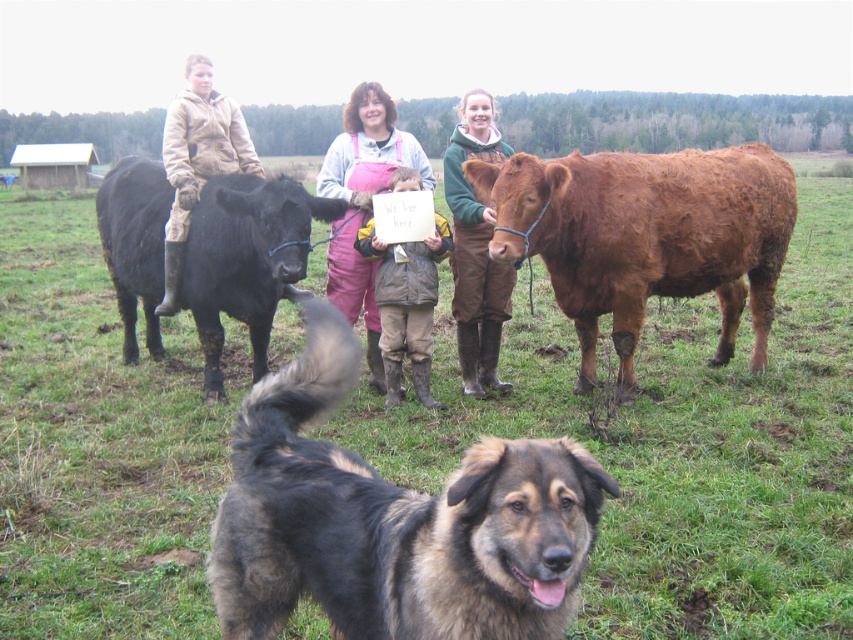
You are standing in the middle of a grassy field and see a brown fur dog at center and a pink overalls at center. Which object is wider?

The brown fur dog at center is wider than the pink overalls at center according to the description.

You are a farmer who wants to build a fence around your property. You need to ensure that the fence is tall enough to keep both the brown fur dog at center and the brown fuzzy bull at right from jumping over it. Based on their heights, what is the minimum height the fence should be?

The brown fur dog at center is shorter than the brown fuzzy bull at right. Therefore, the fence must be at least as tall as the brown fuzzy bull at right to prevent it from jumping over, ensuring both animals are contained.